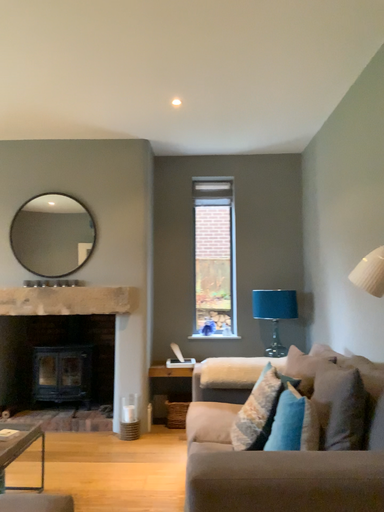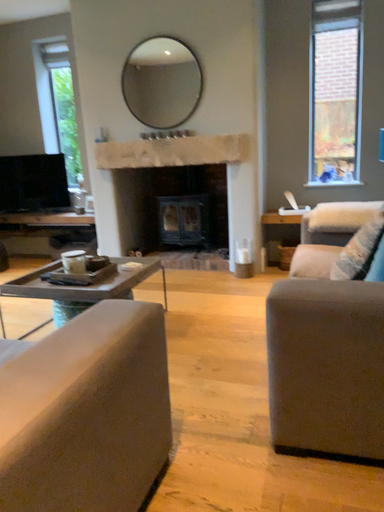
Question: How did the camera likely rotate when shooting the video?

Choices:
 (A) rotated right
 (B) rotated left

Answer: (B)